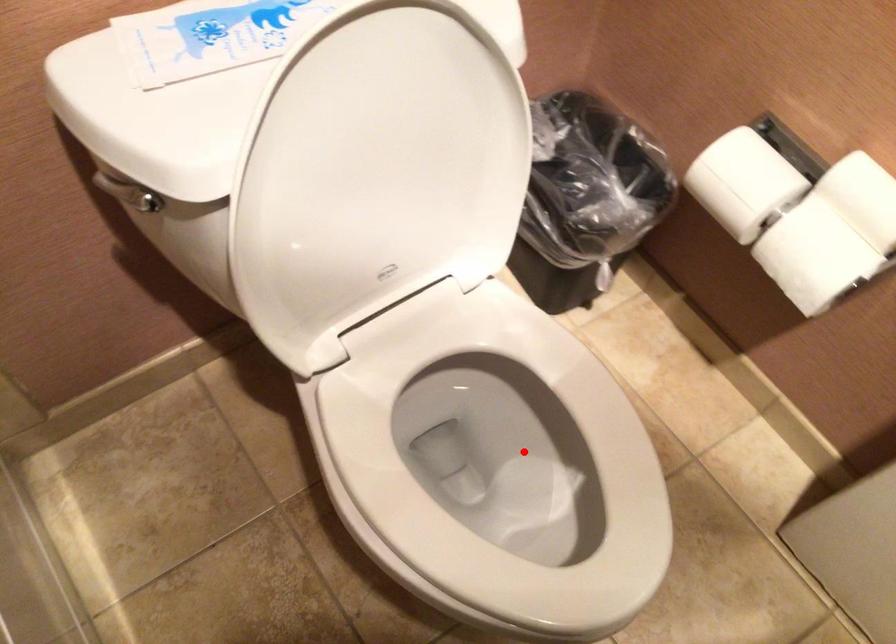
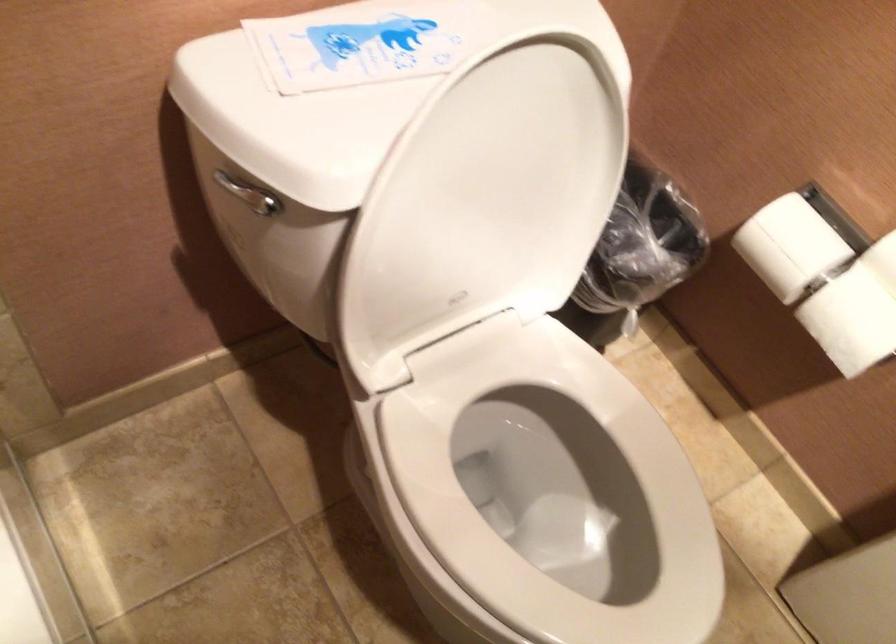
Locate, in the second image, the point that corresponds to the highlighted location in the first image.

(554, 489)